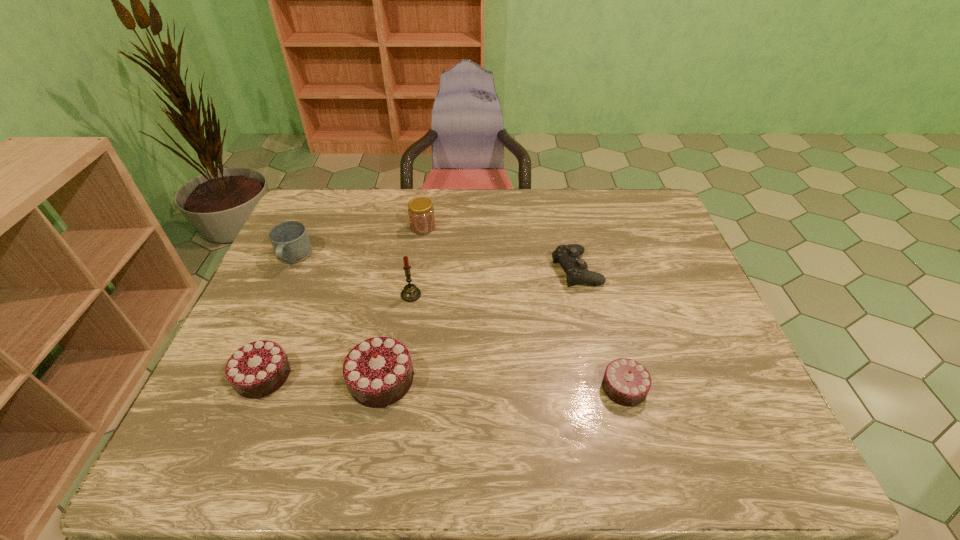
Where is `free region located on the front of the farthest object`? The height and width of the screenshot is (540, 960). free region located on the front of the farthest object is located at coordinates (417, 266).

Locate an element on the screen. The image size is (960, 540). free spot located on the front of the control is located at coordinates (606, 396).

The width and height of the screenshot is (960, 540). Identify the location of vacant region located 0.160m on the right of the tallest object. (480, 295).

What are the coordinates of `vacant space located on the side of the mug with the handle` in the screenshot? It's located at (250, 353).

This screenshot has height=540, width=960. I want to click on object that is at the far edge, so click(421, 213).

The image size is (960, 540). In order to click on chocolate cake present at the left edge in this screenshot , I will do `click(256, 370)`.

Find the location of a particular element. mug that is at the left edge is located at coordinates (290, 241).

Where is `object present at the near left corner`? object present at the near left corner is located at coordinates pos(256,370).

The width and height of the screenshot is (960, 540). In the image, there is a desktop. In order to click on vacant space at the far edge in this screenshot , I will do `click(535, 220)`.

This screenshot has width=960, height=540. In the image, there is a desktop. Find the location of `vacant region at the left edge`. vacant region at the left edge is located at coordinates (283, 273).